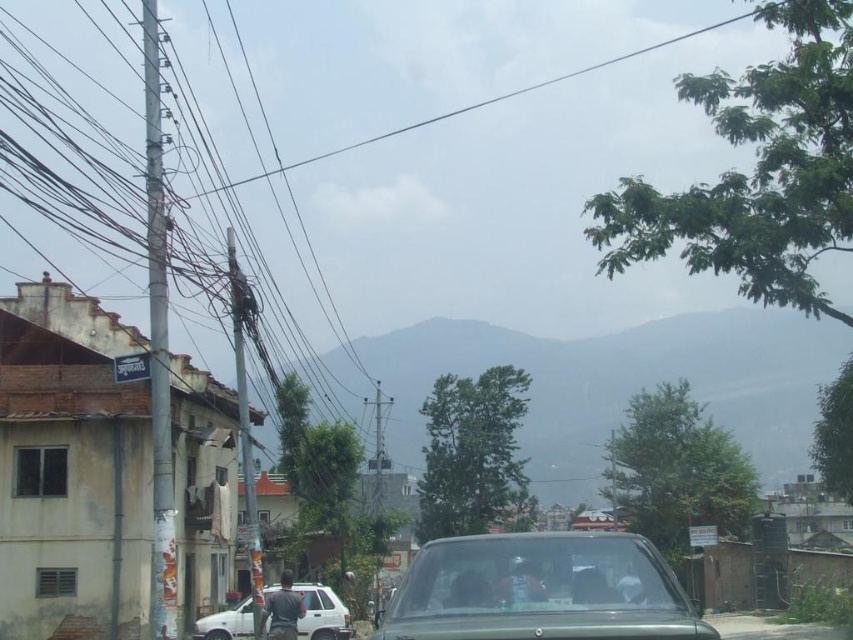
You are a pedestrian standing on the sidewalk and want to cross the street. You see a green matte car at center and a white matte suv at center. Which vehicle is shorter in height?

The green matte car at center has a lesser height compared to the white matte suv at center, so the green matte car at center is shorter.

You are a pedestrian standing on the sidewalk and see the green matte car at center and the white matte suv at center approaching you. Which vehicle is closer to the right side of the road?

The green matte car at center is positioned on the right side of the white matte suv at center, so it is closer to the right side of the road.

You are a pedestrian standing at the edge of the road and see the green matte car at center and the white matte suv at center approaching. Which vehicle will you perceive as being closer to you based on their sizes in the image?

The green matte car at center occupies less space than the white matte suv at center, so it appears smaller and therefore farther away. The white matte suv at center is closer because it takes up more space in the image.